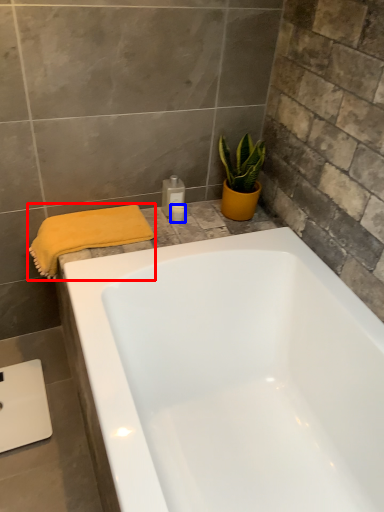
Question: Among these objects, which one is nearest to the camera, bath towel (highlighted by a red box) or toiletry (highlighted by a blue box)?

Choices:
 (A) bath towel
 (B) toiletry

Answer: (A)